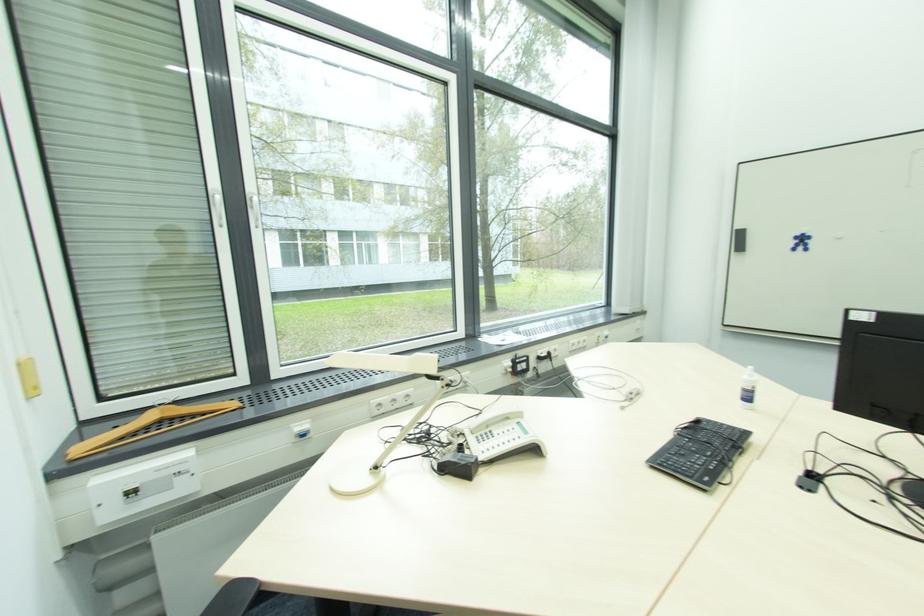
Find the location of a particular element. telephone handset is located at coordinates (489, 444).